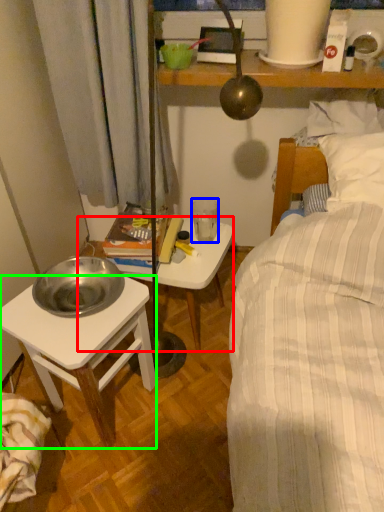
Question: Which is farther away from table (highlighted by a red box)? coffee cup (highlighted by a blue box) or desk (highlighted by a green box)?

Choices:
 (A) coffee cup
 (B) desk

Answer: (B)